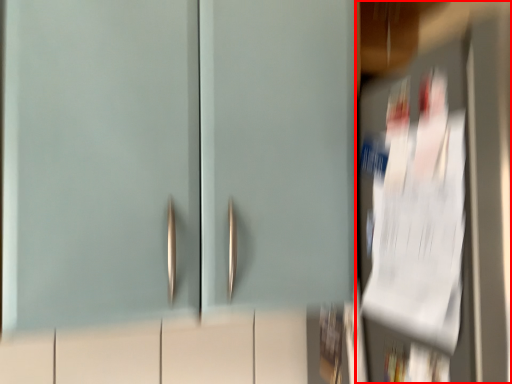
Question: From the image's perspective, where is door (annotated by the red box) located relative to door?

Choices:
 (A) below
 (B) above

Answer: (A)